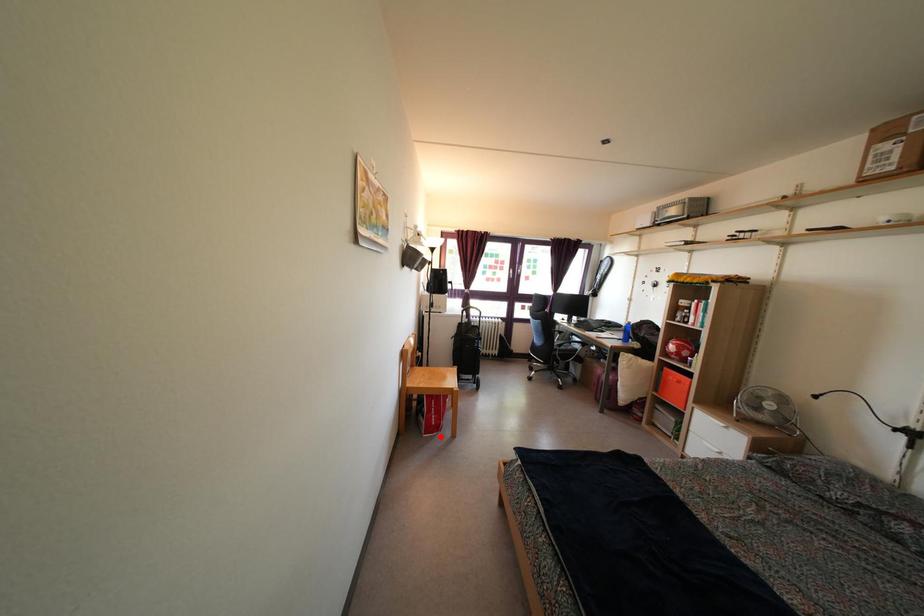
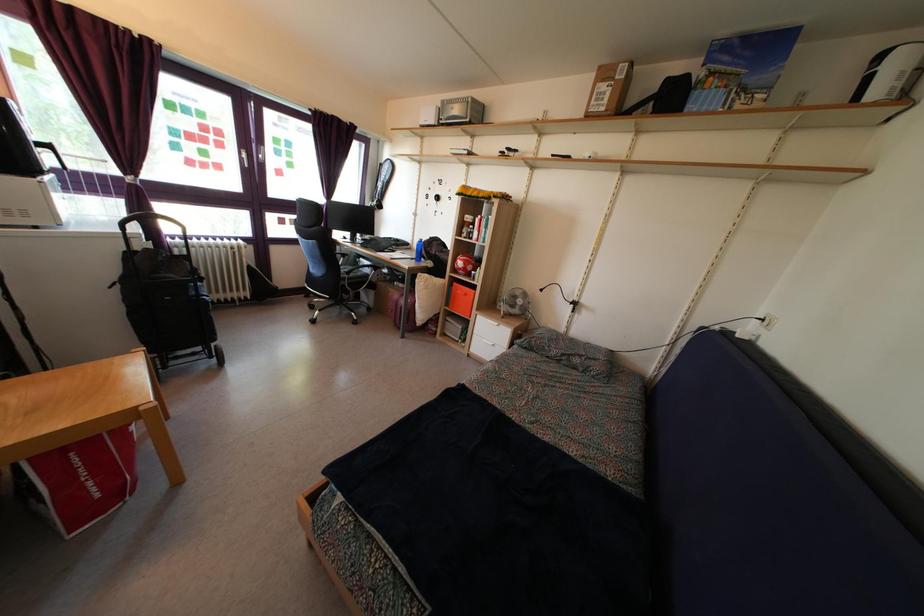
Question: I am providing you with two images of the same scene from different viewpoints. Given a red point in image1, look at the same physical point in image2. Is it:

Choices:
 (A) Closer to the viewpoint
 (B) Farther from the viewpoint

Answer: (A)